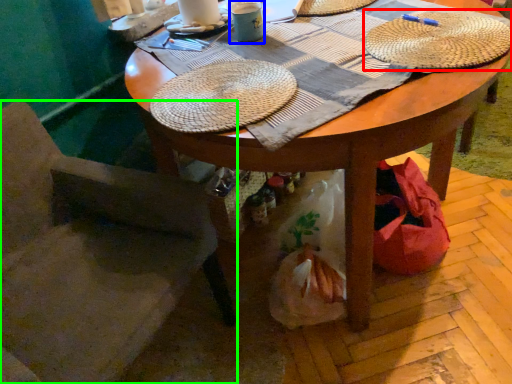
Question: Which object is the farthest from hat (highlighted by a red box)? Choose among these: coffee cup (highlighted by a blue box) or chair (highlighted by a green box).

Choices:
 (A) coffee cup
 (B) chair

Answer: (B)